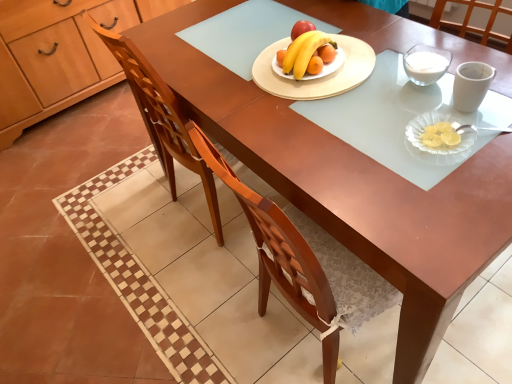
Locate an element on the screen. This screenshot has width=512, height=384. free space in front of yellow matte banana at center is located at coordinates (322, 97).